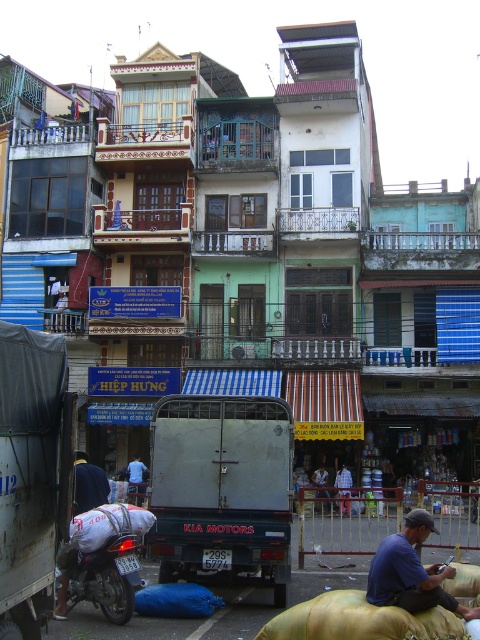
Can you confirm if metallic gray truck at center is shorter than blue cotton shirt at lower right?

No.

Is metallic gray truck at center wider than blue cotton shirt at lower right?

Yes.

Image resolution: width=480 pixels, height=640 pixels. Describe the element at coordinates (222, 488) in the screenshot. I see `metallic gray truck at center` at that location.

At what (x,y) coordinates should I click in order to perform the action: click on metallic gray truck at center. Please return your answer as a coordinate pair (x, y). Looking at the image, I should click on (222, 488).

Which is more to the right, blue cotton shirt at lower right or dark blue shirt at center?

blue cotton shirt at lower right

Is blue cotton shirt at lower right below dark blue shirt at center?

Yes, blue cotton shirt at lower right is below dark blue shirt at center.

What do you see at coordinates (411, 572) in the screenshot? Image resolution: width=480 pixels, height=640 pixels. I see `blue cotton shirt at lower right` at bounding box center [411, 572].

This screenshot has width=480, height=640. What are the coordinates of `blue cotton shirt at lower right` in the screenshot? It's located at (411, 572).

Can you confirm if dark blue shirt at center is shorter than blue striped shirt at center?

Yes, dark blue shirt at center is shorter than blue striped shirt at center.

Who is shorter, dark blue shirt at center or blue striped shirt at center?

With less height is dark blue shirt at center.

I want to click on dark blue shirt at center, so click(88, 484).